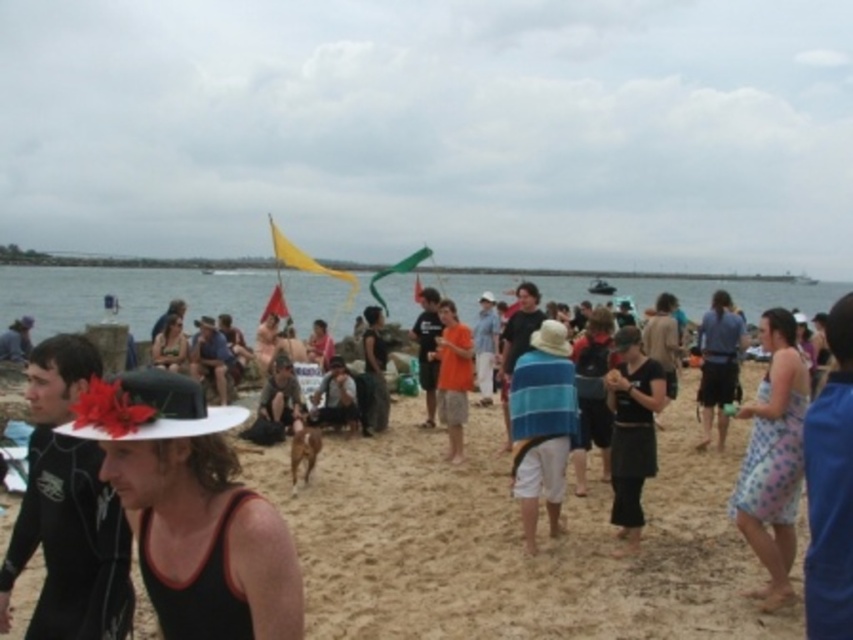
Is point (74, 451) closer to viewer compared to point (547, 452)?

Yes, point (74, 451) is closer to viewer.

Does black wetsuit at left appear under blue striped towel at center?

Actually, black wetsuit at left is above blue striped towel at center.

The image size is (853, 640). Describe the element at coordinates (68, 509) in the screenshot. I see `black wetsuit at left` at that location.

Where is `black wetsuit at left`? Image resolution: width=853 pixels, height=640 pixels. black wetsuit at left is located at coordinates (68, 509).

Who is taller, blue striped towel at lower right or blue striped towel at center?

Standing taller between the two is blue striped towel at lower right.

Between point (844, 378) and point (560, 444), which one is positioned in front?

Positioned in front is point (844, 378).

You are a GUI agent. You are given a task and a screenshot of the screen. Output one action in this format:
    pyautogui.click(x=<x>, y=<y>)
    Task: Click on the blue striped towel at lower right
    The height and width of the screenshot is (640, 853).
    Given the screenshot: What is the action you would take?
    point(830,488)

Does black cotton dress at center have a greater width compared to blue fabric shirt at center-right?

Incorrect, black cotton dress at center's width does not surpass blue fabric shirt at center-right's.

Is black cotton dress at center below blue fabric shirt at center-right?

Correct, black cotton dress at center is located below blue fabric shirt at center-right.

Is point (651, 417) behind point (701, 444)?

That is False.

The height and width of the screenshot is (640, 853). What are the coordinates of `black cotton dress at center` in the screenshot? It's located at (631, 429).